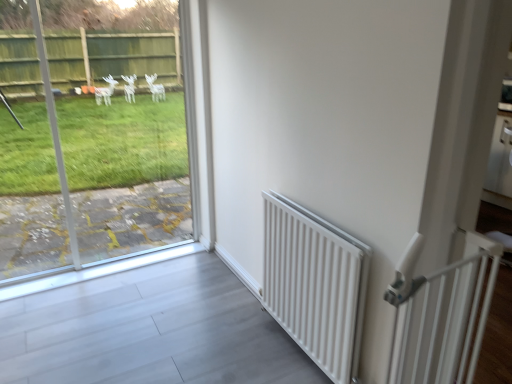
At what (x,y) coordinates should I click in order to perform the action: click on white plastic gate at right. Please return your answer as a coordinate pair (x, y). The image size is (512, 384). Looking at the image, I should click on (442, 315).

This screenshot has height=384, width=512. I want to click on white matte radiator at right, so coord(315,285).

Identify the location of transparent glass window at left. pyautogui.click(x=96, y=151).

Locate an element on the screen. white plastic gate at right is located at coordinates (442, 315).

Considering the sizes of objects white plastic gate at right and transparent glass window at left in the image provided, who is thinner, white plastic gate at right or transparent glass window at left?

Thinner between the two is transparent glass window at left.

Is white plastic gate at right positioned with its back to transparent glass window at left?

Yes, white plastic gate at right is facing away from transparent glass window at left.

From the image's perspective, between white plastic gate at right and transparent glass window at left, who is located below?

white plastic gate at right.

Is transparent glass window at left facing away from white plastic gate at right?

No, transparent glass window at left is not facing away from white plastic gate at right.

From a real-world perspective, between transparent glass window at left and white plastic gate at right, who is vertically higher?

In real-world perspective, transparent glass window at left is above.

From the image's perspective, is transparent glass window at left located above or below white plastic gate at right?

Clearly, from the image's perspective, transparent glass window at left is above white plastic gate at right.

Identify the location of radiator on the left side of white plastic gate at right. (315, 285).

From the picture: From the image's perspective, which is below, white plastic gate at right or white matte radiator at right?

white matte radiator at right.

Would you say white plastic gate at right contains white matte radiator at right?

No, white matte radiator at right is not a part of white plastic gate at right.

Consider the image. Is white plastic gate at right turned away from white matte radiator at right?

That's right, white plastic gate at right is facing away from white matte radiator at right.

In the scene shown: Could you tell me if white matte radiator at right is turned towards white plastic gate at right?

No, white matte radiator at right is not facing towards white plastic gate at right.

Is white matte radiator at right thinner than white plastic gate at right?

Incorrect, the width of white matte radiator at right is not less than that of white plastic gate at right.

Is white matte radiator at right far from white plastic gate at right?

white matte radiator at right is near white plastic gate at right, not far away.

Does white matte radiator at right have a larger size compared to white plastic gate at right?

Yes.

Is transparent glass window at left outside of white matte radiator at right?

Yes.

Locate an element on the screen. radiator below the transparent glass window at left (from the image's perspective) is located at coordinates (315, 285).

Does transparent glass window at left appear on the left side of white matte radiator at right?

Yes.

Between point (84, 266) and point (324, 253), which one is positioned in front?

The point (324, 253) is closer to the camera.

Considering the relative positions of white matte radiator at right and transparent glass window at left in the image provided, is white matte radiator at right to the left of transparent glass window at left from the viewer's perspective?

In fact, white matte radiator at right is to the right of transparent glass window at left.

Can you confirm if white matte radiator at right is wider than transparent glass window at left?

Yes, white matte radiator at right is wider than transparent glass window at left.

Where is `radiator in front of the transparent glass window at left`? Image resolution: width=512 pixels, height=384 pixels. radiator in front of the transparent glass window at left is located at coordinates (315, 285).

This screenshot has height=384, width=512. I want to click on balustrade to the right of transparent glass window at left, so click(x=442, y=315).

Where is `balustrade below the transparent glass window at left (from a real-world perspective)`? balustrade below the transparent glass window at left (from a real-world perspective) is located at coordinates (442, 315).

From the image, which object appears to be nearer to white matte radiator at right, transparent glass window at left or white plastic gate at right?

white plastic gate at right.

Which object lies nearer to the anchor point white plastic gate at right, transparent glass window at left or white matte radiator at right?

Based on the image, white matte radiator at right appears to be nearer to white plastic gate at right.

Which object lies further to the anchor point white matte radiator at right, white plastic gate at right or transparent glass window at left?

The object further to white matte radiator at right is transparent glass window at left.

Which object lies further to the anchor point white plastic gate at right, white matte radiator at right or transparent glass window at left?

The object further to white plastic gate at right is transparent glass window at left.

Based on the photo, estimate the real-world distances between objects in this image. Which object is closer to transparent glass window at left, white matte radiator at right or white plastic gate at right?

white matte radiator at right is closer to transparent glass window at left.

In the scene shown: Considering their positions, is white plastic gate at right positioned further to transparent glass window at left than white matte radiator at right?

white plastic gate at right lies further to transparent glass window at left than the other object.

Find the location of `radiator situated between transparent glass window at left and white plastic gate at right from left to right`. radiator situated between transparent glass window at left and white plastic gate at right from left to right is located at coordinates (315, 285).